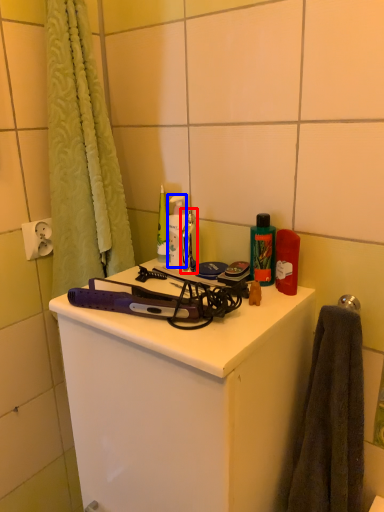
Question: Which of the following is the closest to the observer, faucet (highlighted by a red box) or toiletry (highlighted by a blue box)?

Choices:
 (A) faucet
 (B) toiletry

Answer: (A)